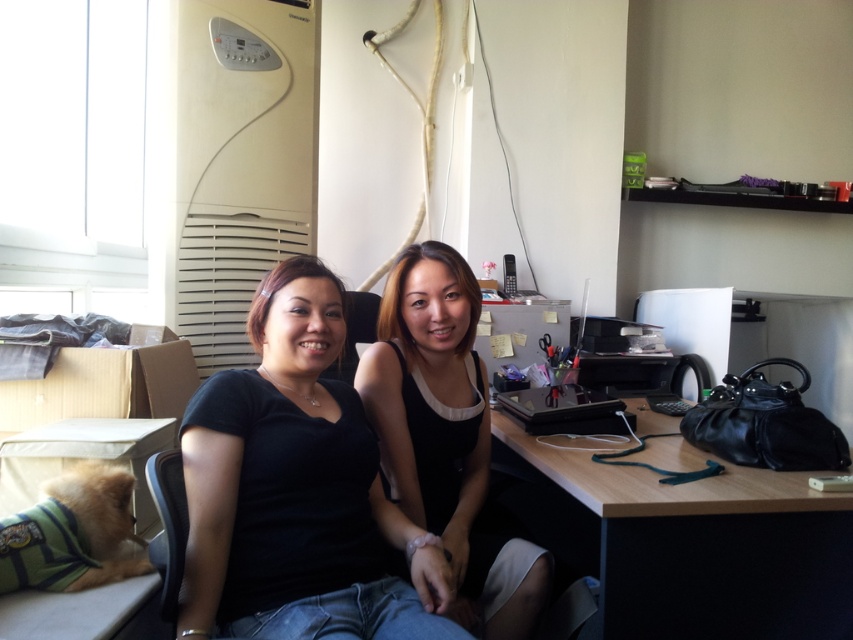
Question: Where is black matte shirt at center located in relation to wooden desk at right in the image?

Choices:
 (A) above
 (B) below

Answer: (A)

Question: Which point is farther from the camera taking this photo?

Choices:
 (A) [x=402, y=333]
 (B) [x=801, y=483]

Answer: (A)

Question: Based on their relative distances, which object is farther from the black matte shirt at center?

Choices:
 (A) wooden desk at right
 (B) black matte dress at center

Answer: (A)

Question: Which object appears closest to the camera in this image?

Choices:
 (A) black matte dress at center
 (B) black matte shirt at center
 (C) wooden desk at right

Answer: (B)

Question: Can you confirm if black matte shirt at center is thinner than black matte dress at center?

Choices:
 (A) yes
 (B) no

Answer: (B)

Question: Is black matte shirt at center above wooden desk at right?

Choices:
 (A) no
 (B) yes

Answer: (B)